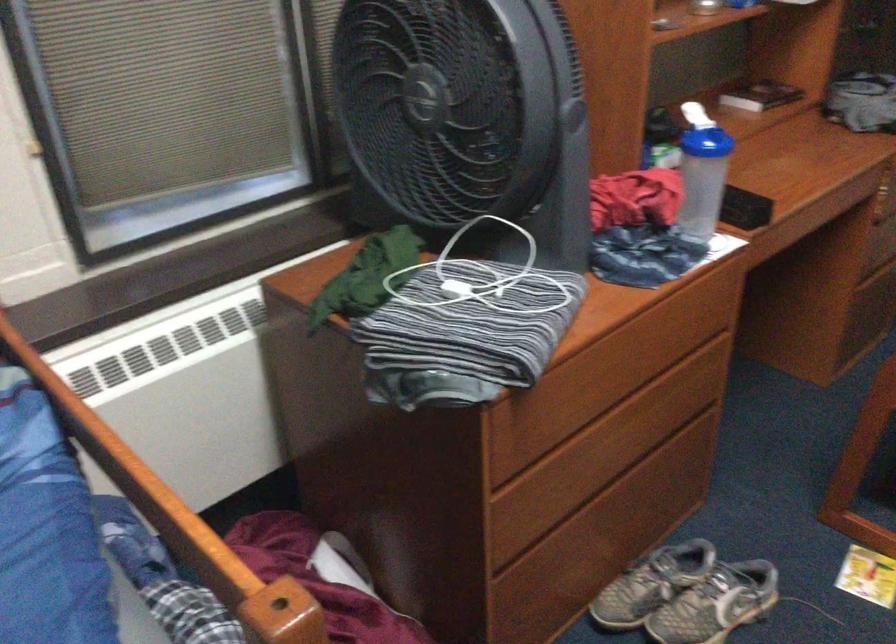
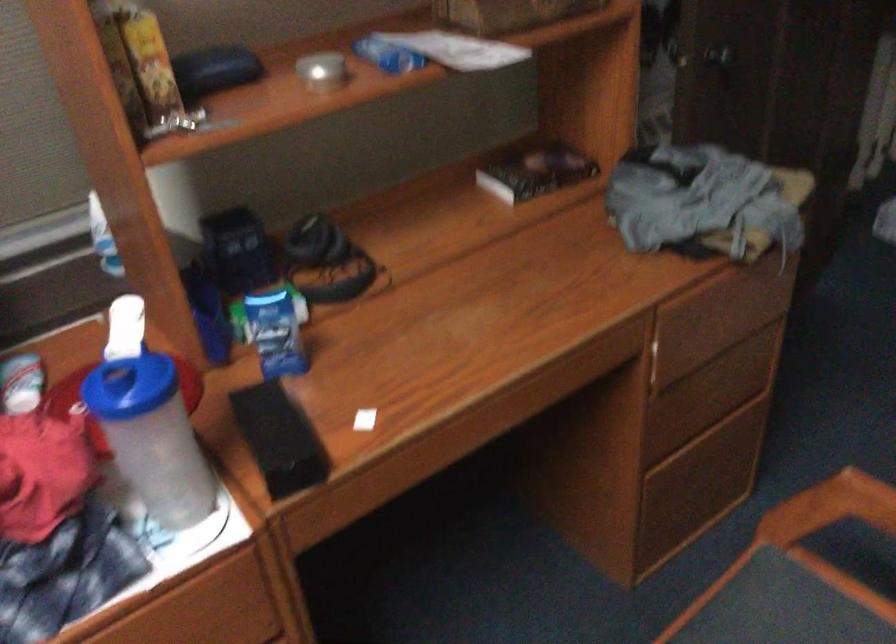
The images are taken continuously from a first-person perspective. In which direction are you moving?

The cameraman moved toward right, forward.